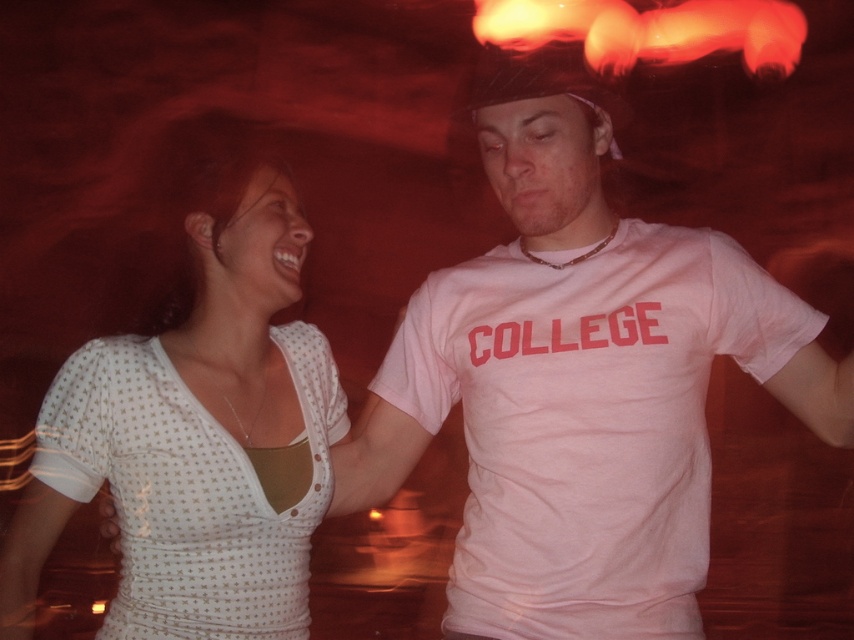
Question: Observing the image, what is the correct spatial positioning of pink cotton t-shirt at center in reference to white dotted fabric at center?

Choices:
 (A) left
 (B) right

Answer: (B)

Question: Among these objects, which one is nearest to the camera?

Choices:
 (A) pink cotton t-shirt at center
 (B) white dotted fabric at center

Answer: (A)

Question: Can you confirm if pink cotton t-shirt at center is smaller than white dotted fabric at center?

Choices:
 (A) yes
 (B) no

Answer: (B)

Question: Can you confirm if pink cotton t-shirt at center is positioned below white dotted fabric at center?

Choices:
 (A) yes
 (B) no

Answer: (B)